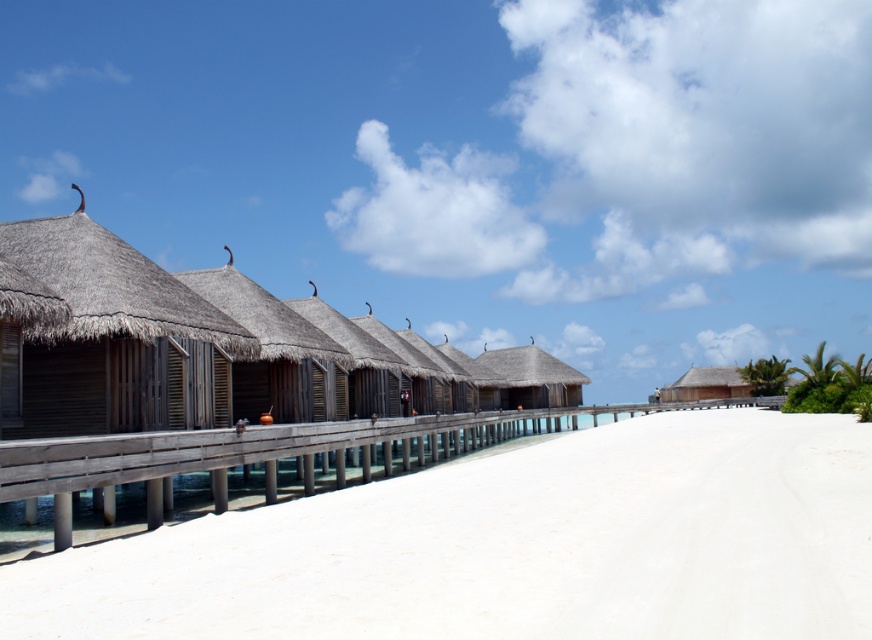
Question: Observing the image, what is the correct spatial positioning of wooden at center in reference to thatched wood hut at center?

Choices:
 (A) right
 (B) left

Answer: (B)

Question: Among these objects, which one is farthest from the camera?

Choices:
 (A) wooden at center
 (B) thatched wood hut at center

Answer: (B)

Question: Which object is farther from the camera taking this photo?

Choices:
 (A) wooden at center
 (B) thatched wood hut at center

Answer: (B)

Question: Can you confirm if wooden at center is positioned above thatched wood hut at center?

Choices:
 (A) no
 (B) yes

Answer: (A)

Question: Does wooden at center have a greater width compared to thatched wood hut at center?

Choices:
 (A) no
 (B) yes

Answer: (B)

Question: Among these points, which one is farthest from the camera?

Choices:
 (A) (439, 413)
 (B) (535, 378)

Answer: (B)